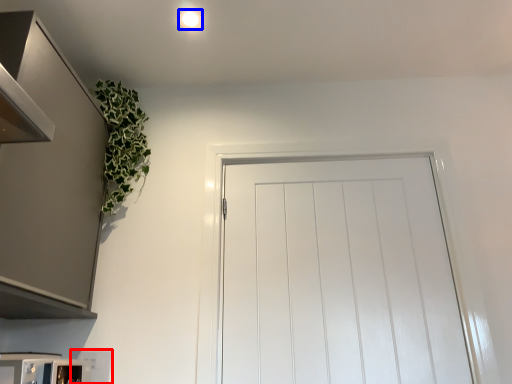
Question: Which object appears farthest to the camera in this image, appliance (highlighted by a red box) or lighting (highlighted by a blue box)?

Choices:
 (A) appliance
 (B) lighting

Answer: (B)